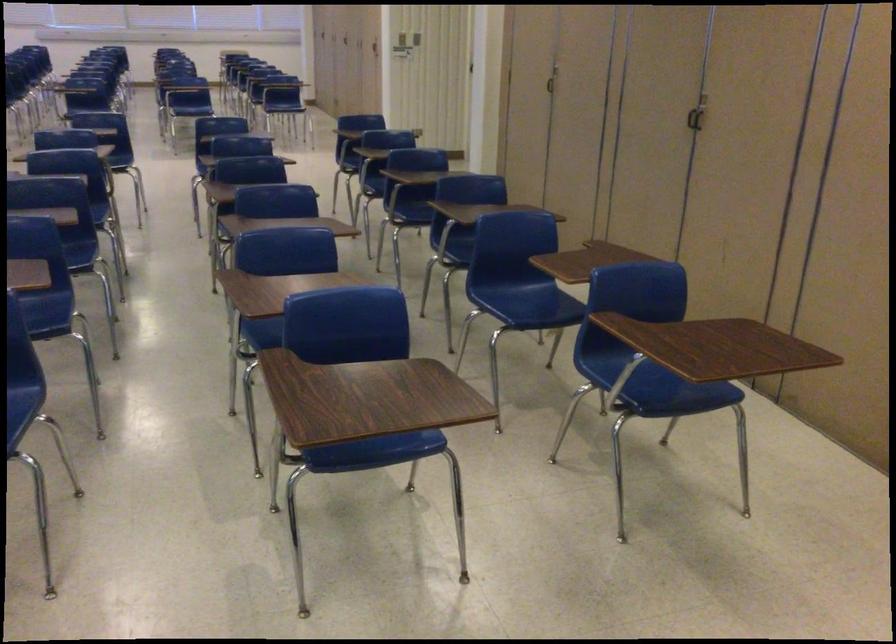
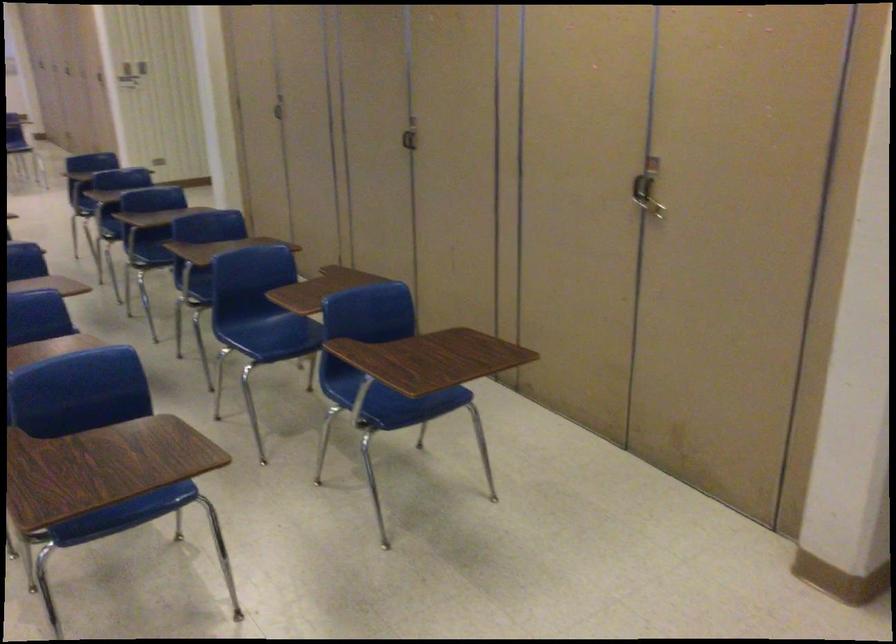
In the second image, find the point that corresponds to [694,118] in the first image.

(409, 136)